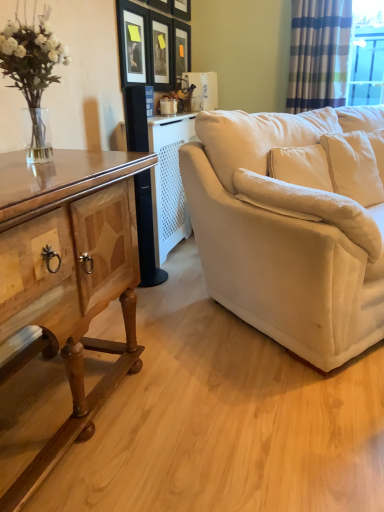
Question: Can you confirm if striped fabric curtain at upper right is positioned to the right of wooden picture frame at upper center, positioned as the 4th picture frame in left-to-right order?

Choices:
 (A) no
 (B) yes

Answer: (B)

Question: Is striped fabric curtain at upper right not inside wooden picture frame at upper center, placed as the first picture frame when sorted from right to left?

Choices:
 (A) no
 (B) yes

Answer: (B)

Question: Does striped fabric curtain at upper right have a larger size compared to wooden picture frame at upper center, placed as the first picture frame when sorted from right to left?

Choices:
 (A) no
 (B) yes

Answer: (B)

Question: Does striped fabric curtain at upper right lie in front of wooden picture frame at upper center, placed as the first picture frame when sorted from right to left?

Choices:
 (A) yes
 (B) no

Answer: (A)

Question: Is striped fabric curtain at upper right looking in the opposite direction of wooden picture frame at upper center, placed as the first picture frame when sorted from right to left?

Choices:
 (A) no
 (B) yes

Answer: (A)

Question: In terms of height, does white glossy coffee cup at center look taller or shorter compared to matte black picture frame at upper center, marked as the 1th picture frame in a left-to-right arrangement?

Choices:
 (A) short
 (B) tall

Answer: (A)

Question: From the image's perspective, is white glossy coffee cup at center positioned above or below matte black picture frame at upper center, the fourth picture frame positioned from the right?

Choices:
 (A) below
 (B) above

Answer: (A)

Question: Considering the relative positions of white glossy coffee cup at center and matte black picture frame at upper center, marked as the 1th picture frame in a left-to-right arrangement, in the image provided, is white glossy coffee cup at center to the left or to the right of matte black picture frame at upper center, marked as the 1th picture frame in a left-to-right arrangement,?

Choices:
 (A) left
 (B) right

Answer: (B)

Question: Looking at their shapes, would you say white glossy coffee cup at center is wider or thinner than matte black picture frame at upper center, marked as the 1th picture frame in a left-to-right arrangement?

Choices:
 (A) thin
 (B) wide

Answer: (B)

Question: Is point (180, 6) positioned closer to the camera than point (347, 10)?

Choices:
 (A) closer
 (B) farther

Answer: (B)

Question: Considering the positions of matte black picture frame at upper center, acting as the 3th picture frame starting from the left, and striped fabric curtain at upper right in the image, is matte black picture frame at upper center, acting as the 3th picture frame starting from the left, taller or shorter than striped fabric curtain at upper right?

Choices:
 (A) tall
 (B) short

Answer: (B)

Question: Relative to striped fabric curtain at upper right, is matte black picture frame at upper center, acting as the 3th picture frame starting from the left, in front or behind?

Choices:
 (A) behind
 (B) front

Answer: (B)

Question: In terms of size, does matte black picture frame at upper center, acting as the 3th picture frame starting from the left, appear bigger or smaller than striped fabric curtain at upper right?

Choices:
 (A) small
 (B) big

Answer: (A)

Question: From a real-world perspective, is matte black picture frame at upper center, acting as the 3th picture frame starting from the left, positioned above or below matte black picture frame at upper center, the second picture frame viewed from the left?

Choices:
 (A) above
 (B) below

Answer: (A)

Question: Considering the positions of point (185, 0) and point (152, 48), is point (185, 0) closer or farther from the camera than point (152, 48)?

Choices:
 (A) farther
 (B) closer

Answer: (A)